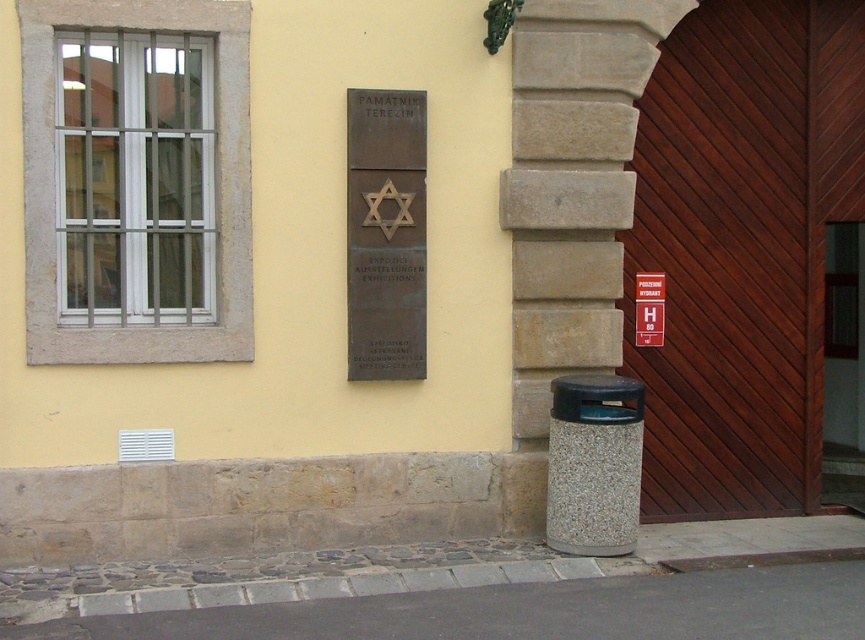
What are the coordinates of the bronze plaque at center in the image?

The bronze plaque at center is located at coordinates point (386, 234).

You are standing in front of the building and need to enter through one of the doors. Which door is closer to the plaque? Please choose between the dark brown wood door at center right and the wooden door at center.

The dark brown wood door at center right is to the left of the wooden door at center, so the wooden door at center is closer to the plaque.